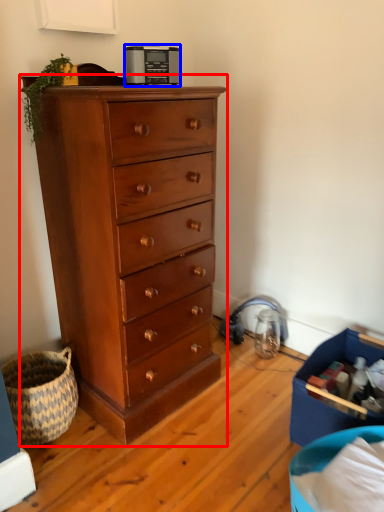
Question: Among these objects, which one is farthest to the camera, chest of drawers (highlighted by a red box) or appliance (highlighted by a blue box)?

Choices:
 (A) chest of drawers
 (B) appliance

Answer: (B)